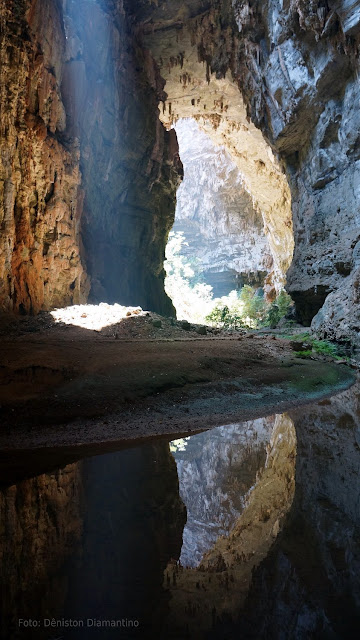
The height and width of the screenshot is (640, 360). What are the coordinates of `light` in the screenshot? It's located at (90, 315).